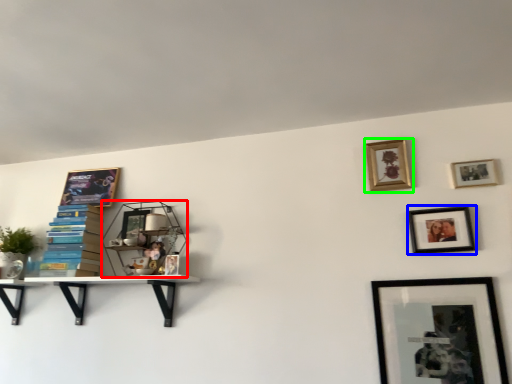
Question: Considering the real-world distances, which object is closest to shelf (highlighted by a red box)? picture frame (highlighted by a blue box) or picture frame (highlighted by a green box).

Choices:
 (A) picture frame
 (B) picture frame

Answer: (B)